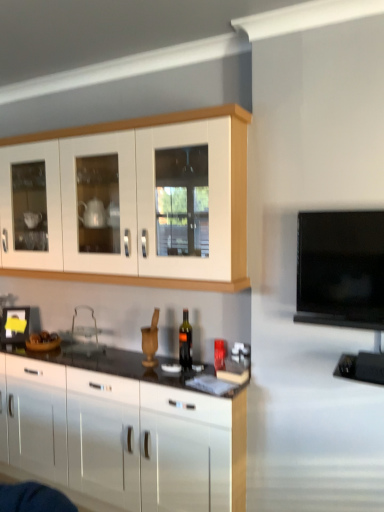
Where is `free space above glossy white cabinets at center, placed as the 2th cabinetry when sorted from top to bottom (from a real-world perspective)`? The width and height of the screenshot is (384, 512). free space above glossy white cabinets at center, placed as the 2th cabinetry when sorted from top to bottom (from a real-world perspective) is located at coordinates (120, 359).